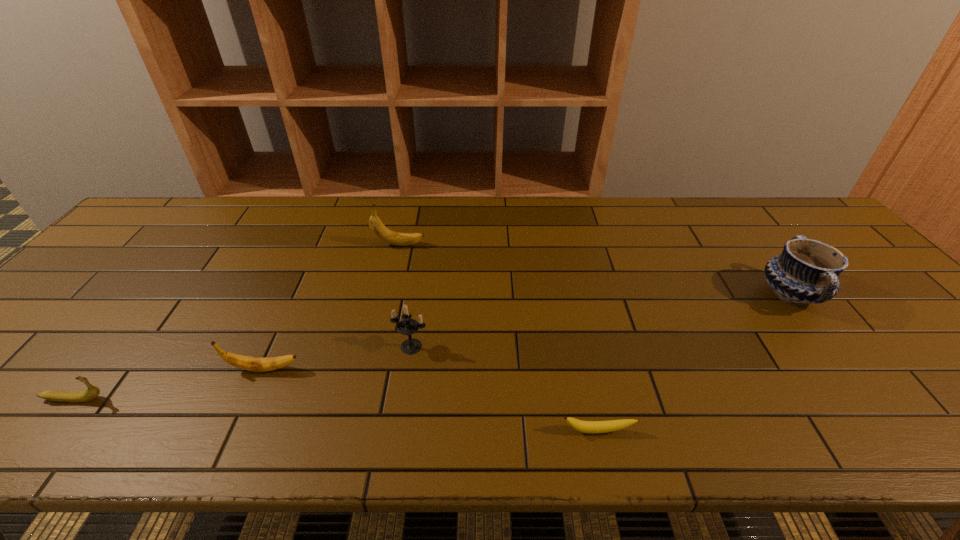
Find the location of a particular element. the farthest banana is located at coordinates (x=379, y=229).

Where is `the tallest banana`? Image resolution: width=960 pixels, height=540 pixels. the tallest banana is located at coordinates (379, 229).

Locate an element on the screen. the fifth nearest object is located at coordinates (806, 272).

Locate an element on the screen. The image size is (960, 540). pottery is located at coordinates (806, 272).

You are a GUI agent. You are given a task and a screenshot of the screen. Output one action in this format:
    pyautogui.click(x=<x>, y=<y>)
    Task: Click on the fourth nearest object
    This screenshot has height=540, width=960.
    Given the screenshot: What is the action you would take?
    pyautogui.click(x=408, y=326)

Find the location of a particular element. the third nearest object is located at coordinates (258, 364).

Identify the location of the fifth object from right to left. The width and height of the screenshot is (960, 540). (258, 364).

At what (x,y) coordinates should I click in order to perform the action: click on the leftmost object. Please return your answer as a coordinate pair (x, y). The width and height of the screenshot is (960, 540). Looking at the image, I should click on (92, 392).

You are a GUI agent. You are given a task and a screenshot of the screen. Output one action in this format:
    pyautogui.click(x=<x>, y=<y>)
    Task: Click on the fifth farthest object
    Image resolution: width=960 pixels, height=540 pixels.
    Given the screenshot: What is the action you would take?
    pyautogui.click(x=92, y=392)

This screenshot has width=960, height=540. What are the coordinates of `the shortest object` in the screenshot? It's located at (591, 427).